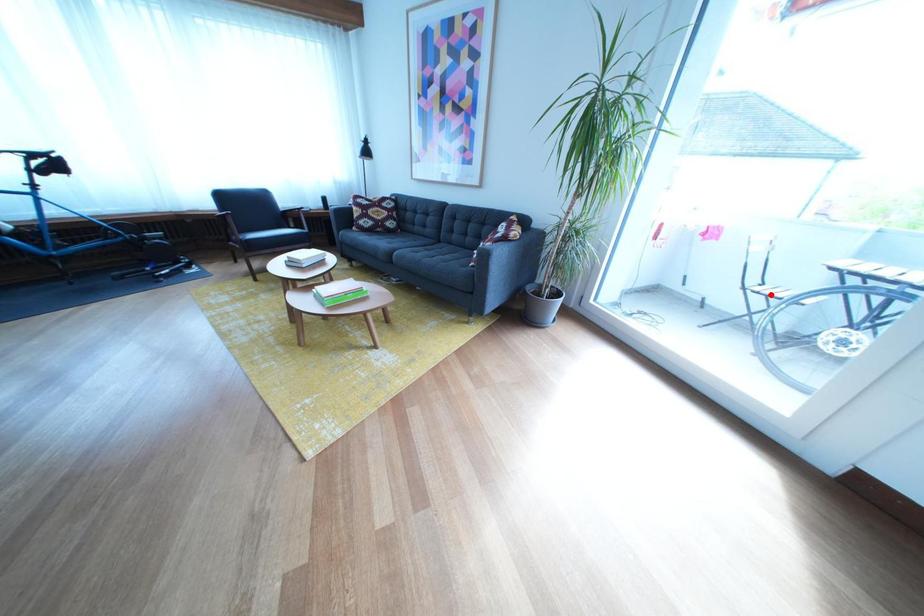
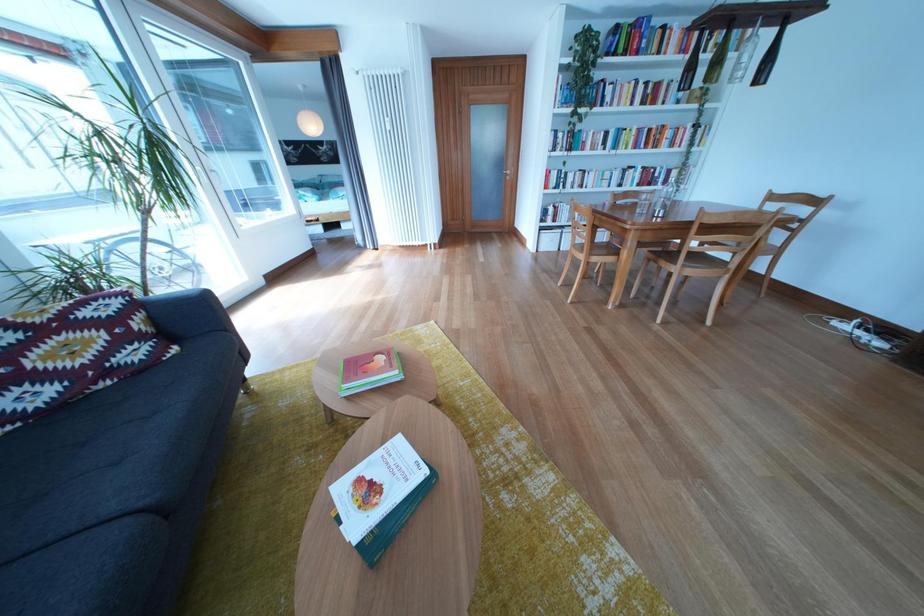
Question: I am providing you with two images of the same scene from different viewpoints. A red point is marked on the first image. Can you still see the location of the red point in image 2?

Choices:
 (A) Yes
 (B) No

Answer: (B)